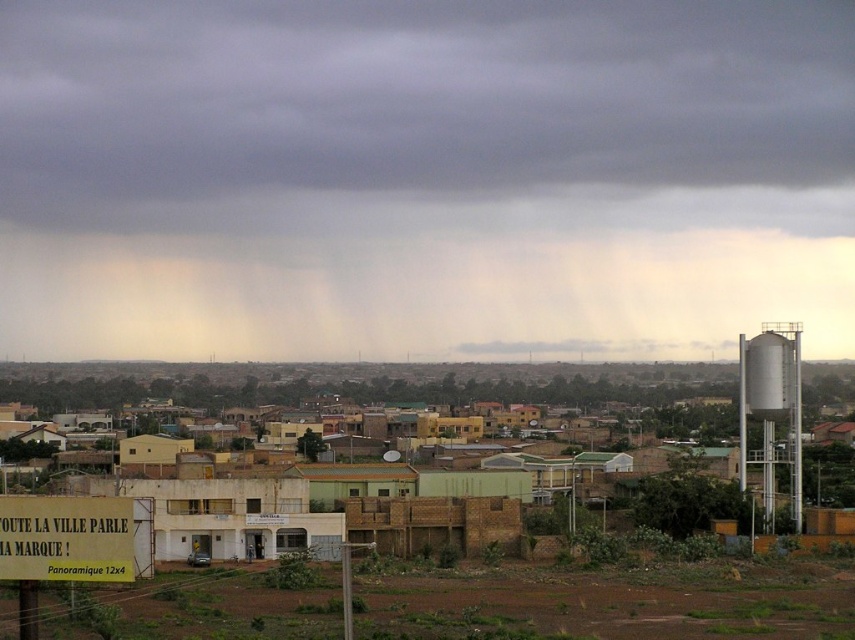
Is dark gray cloud at upper center to the left of yellow brick building at center from the viewer's perspective?

Incorrect, dark gray cloud at upper center is not on the left side of yellow brick building at center.

What do you see at coordinates (411, 100) in the screenshot? I see `dark gray cloud at upper center` at bounding box center [411, 100].

This screenshot has height=640, width=855. Describe the element at coordinates (411, 100) in the screenshot. I see `dark gray cloud at upper center` at that location.

Locate an element on the screen. This screenshot has height=640, width=855. dark gray cloud at upper center is located at coordinates (411, 100).

Can you confirm if yellow brick building at center is positioned to the left of silver metallic water tower at right?

Indeed, yellow brick building at center is positioned on the left side of silver metallic water tower at right.

In order to click on yellow brick building at center in this screenshot , I will do `click(394, 387)`.

Does dark gray cloud at upper center appear on the right side of green leafy bush at lower right?

No, dark gray cloud at upper center is not to the right of green leafy bush at lower right.

Consider the image. Is dark gray cloud at upper center positioned at the back of green leafy bush at lower right?

Yes, it is.

What do you see at coordinates (411, 100) in the screenshot? I see `dark gray cloud at upper center` at bounding box center [411, 100].

Image resolution: width=855 pixels, height=640 pixels. I want to click on dark gray cloud at upper center, so click(411, 100).